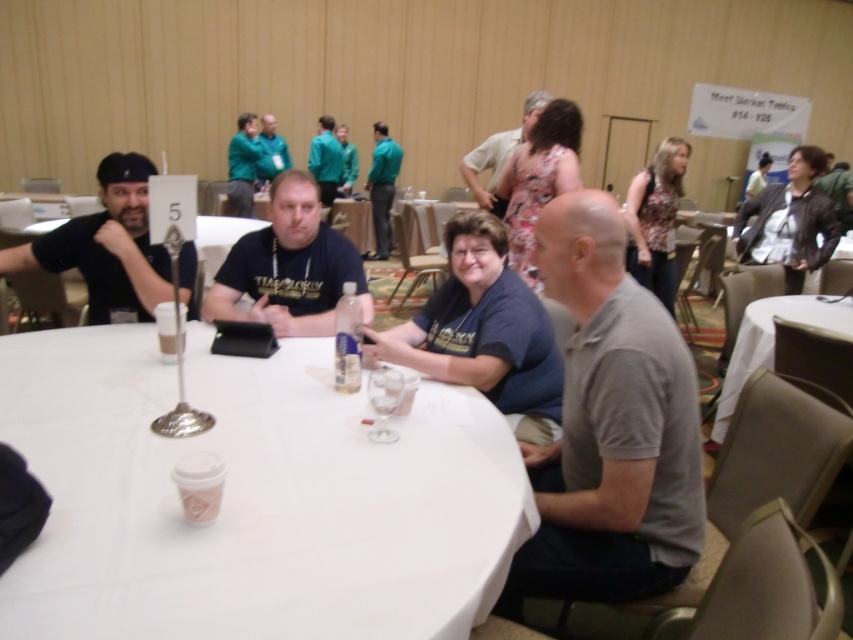
Question: Does gray cotton polo shirt at center appear on the left side of matte black t-shirt at center?

Choices:
 (A) no
 (B) yes

Answer: (A)

Question: Which of the following is the closest to the observer?

Choices:
 (A) click(289, 243)
 (B) click(264, 173)

Answer: (A)

Question: Which of the following is the farthest from the observer?

Choices:
 (A) (55, 445)
 (B) (529, 468)
 (C) (115, 188)

Answer: (C)

Question: Can you confirm if white matte table at center is positioned above white fabric table at lower right?

Choices:
 (A) no
 (B) yes

Answer: (A)

Question: Considering the relative positions of matte black t-shirt at center and floral fabric dress at upper center in the image provided, where is matte black t-shirt at center located with respect to floral fabric dress at upper center?

Choices:
 (A) below
 (B) above

Answer: (A)

Question: Which of the following is the farthest from the observer?

Choices:
 (A) (316, 509)
 (B) (834, 324)

Answer: (B)